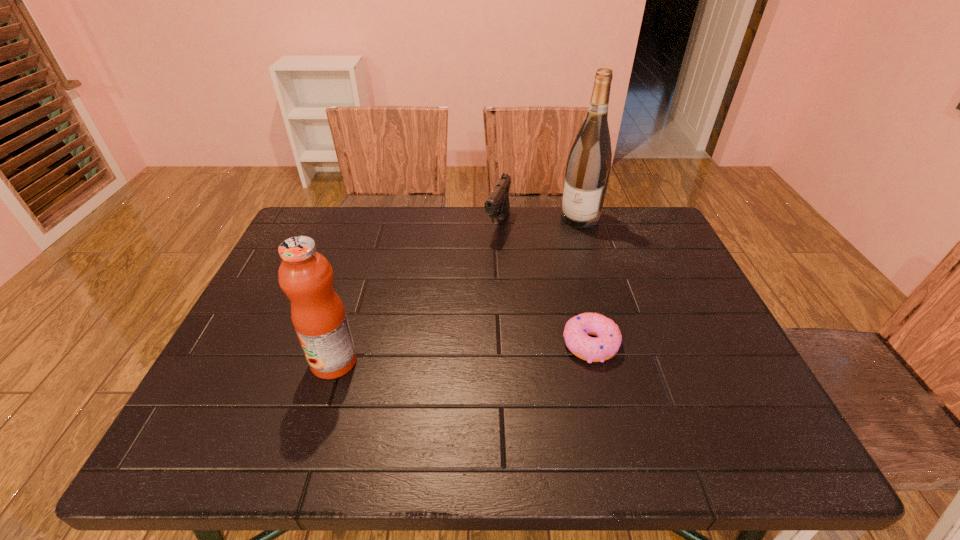
Locate an element on the screen. free point at the near edge is located at coordinates (607, 396).

The height and width of the screenshot is (540, 960). In order to click on vacant space at the left edge in this screenshot , I will do click(x=294, y=349).

The height and width of the screenshot is (540, 960). Identify the location of free region at the right edge of the desktop. (665, 266).

Where is `free location at the near left corner`? The image size is (960, 540). free location at the near left corner is located at coordinates click(x=245, y=413).

At what (x,y) coordinates should I click in order to perform the action: click on free point at the far right corner. Please return your answer as a coordinate pair (x, y). This screenshot has width=960, height=540. Looking at the image, I should click on (654, 214).

This screenshot has width=960, height=540. I want to click on blank region between the third tallest object and the fruit juice, so click(416, 293).

At what (x,y) coordinates should I click in order to perform the action: click on vacant space in between the tallest object and the shortest object. Please return your answer as a coordinate pair (x, y). Looking at the image, I should click on (585, 281).

The image size is (960, 540). I want to click on free space between the doughnut and the wine bottle, so click(585, 281).

Find the location of a particular element. empty space between the leftmost object and the shortest object is located at coordinates (462, 353).

The height and width of the screenshot is (540, 960). I want to click on vacant space that is in between the wine bottle and the pistol, so click(x=539, y=221).